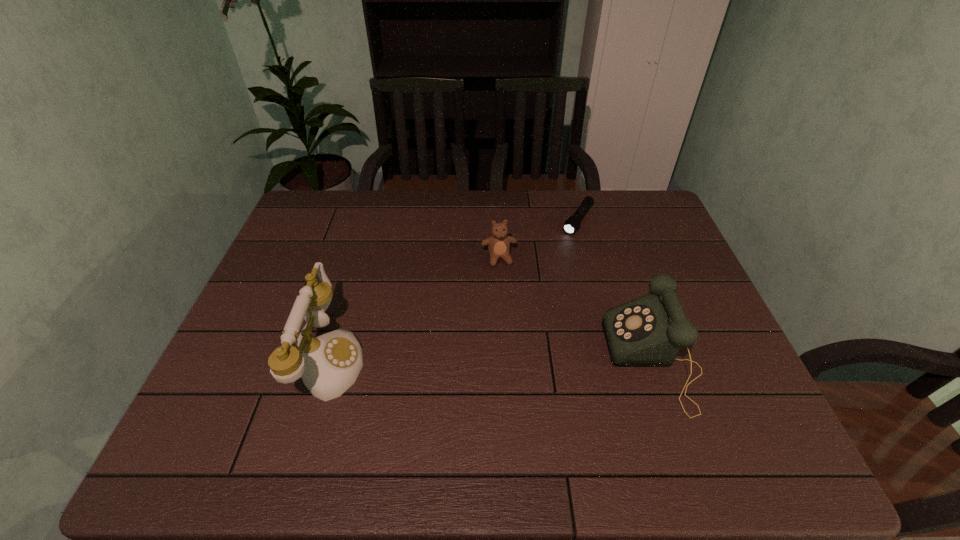
Where is `free space on the desktop that is between the leftmost object and the right telephone and is positioned on the front-facing side of the second object from left to right`? The height and width of the screenshot is (540, 960). free space on the desktop that is between the leftmost object and the right telephone and is positioned on the front-facing side of the second object from left to right is located at coordinates [522, 360].

What are the coordinates of `vacant space on the desktop that is between the left telephone and the third shortest object and is positioned at the lens end of the farthest object` in the screenshot? It's located at (480, 360).